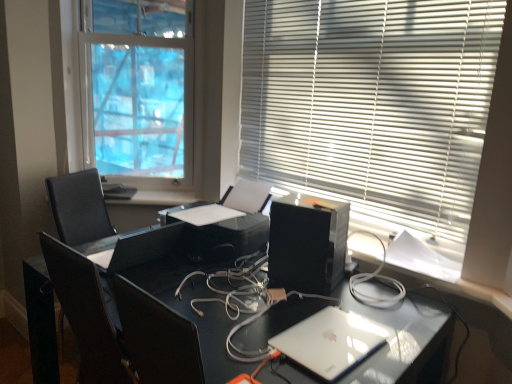
At what (x,y) coordinates should I click in order to perform the action: click on vacant space in between matte black monitor at center and satin white laptop at lower right. Please return your answer as a coordinate pair (x, y). Looking at the image, I should click on (223, 305).